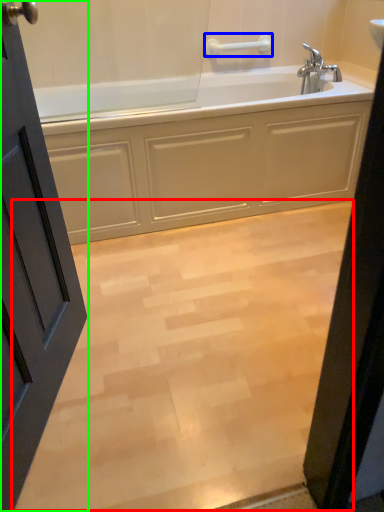
Question: Which is nearer to the plain (highlighted by a red box)? towel bar (highlighted by a blue box) or door (highlighted by a green box).

Choices:
 (A) towel bar
 (B) door

Answer: (B)